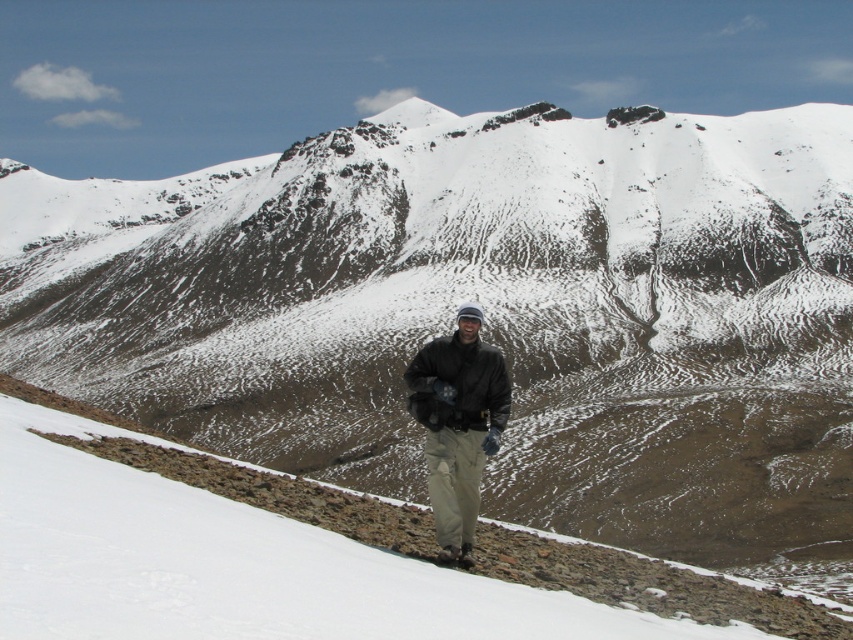
You are a hiker trying to navigate through the mountain path. You see the white snow at center and the black matte jacket at center. Which object is located to the left of the other?

The white snow at center is positioned on the left side of black matte jacket at center, so the white snow at center is to the left of the black matte jacket at center.

You are a hiker planning to move from the point closer to you to the point further away in the mountain scene. Which path would you take between the two points, point (693, 628) and point (445, 365)?

You should take the path from point (693, 628) to point (445, 365) because point (693, 628) is closer to the viewer and you want to move to the point further away, which is point (445, 365).